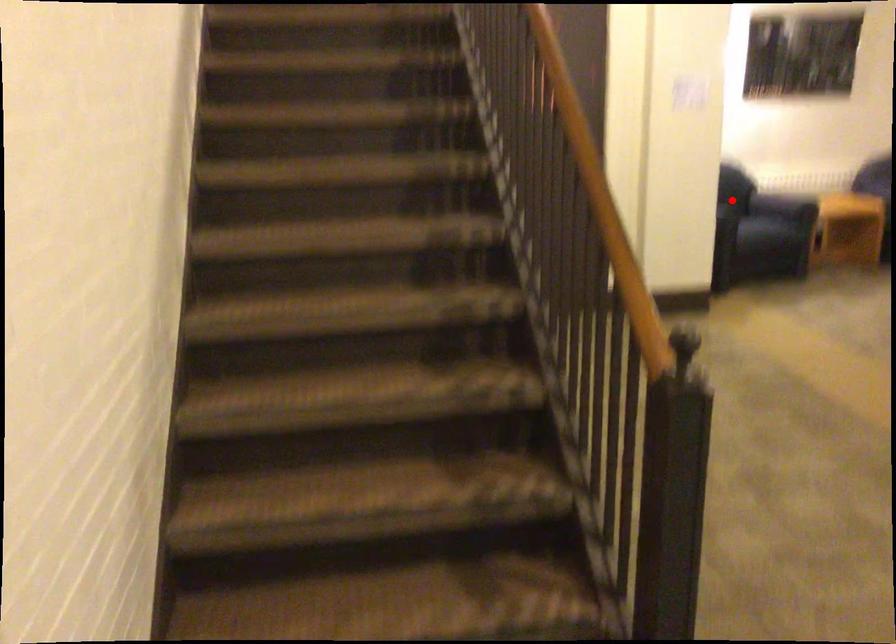
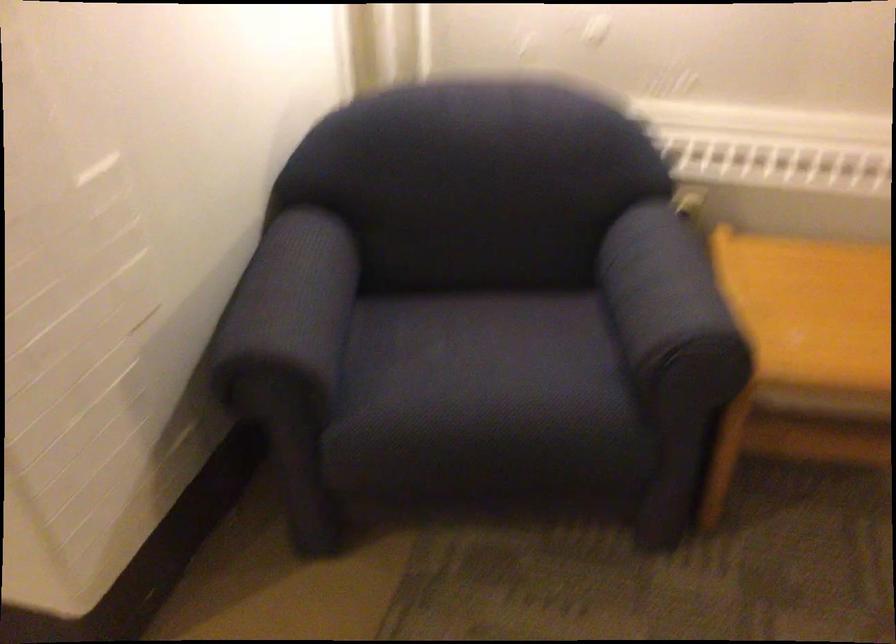
Find the pixel in the second image that matches the highlighted location in the first image.

(289, 307)